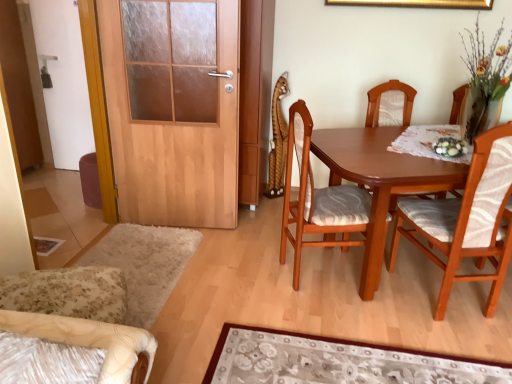
The height and width of the screenshot is (384, 512). What do you see at coordinates (390, 104) in the screenshot? I see `wooden chair with patterned cushion at center, which is counted as the second chair, starting from the right` at bounding box center [390, 104].

Image resolution: width=512 pixels, height=384 pixels. In order to click on wooden door at left in this screenshot , I will do `click(173, 108)`.

This screenshot has width=512, height=384. What do you see at coordinates (466, 219) in the screenshot?
I see `wooden chair with patterned cushion at right, which appears as the 4th chair when viewed from the left` at bounding box center [466, 219].

This screenshot has height=384, width=512. In order to click on floral carpet at lower center in this screenshot , I will do `click(336, 361)`.

Describe the element at coordinates (336, 361) in the screenshot. I see `floral carpet at lower center` at that location.

Describe the element at coordinates (317, 199) in the screenshot. I see `wooden chair with patterned cushion at center, the second chair from the left` at that location.

Find the location of a particular element. The width and height of the screenshot is (512, 384). wooden chair with patterned cushion at center, positioned as the third chair in right-to-left order is located at coordinates (317, 199).

Image resolution: width=512 pixels, height=384 pixels. I want to click on gold metallic picture frame at upper center, so click(418, 3).

Locate an element on the screen. The width and height of the screenshot is (512, 384). wooden chair with patterned cushion at center, which is the 3th chair from left to right is located at coordinates (390, 104).

Between point (50, 49) and point (435, 3), which one is positioned in front?

The point (435, 3) is closer to the camera.

Can you confirm if white glossy door at left is shorter than gold metallic picture frame at upper center?

No, white glossy door at left is not shorter than gold metallic picture frame at upper center.

Is gold metallic picture frame at upper center inside white glossy door at left?

No, gold metallic picture frame at upper center is not surrounded by white glossy door at left.

The height and width of the screenshot is (384, 512). I want to click on screen door beneath the gold metallic picture frame at upper center (from a real-world perspective), so click(x=64, y=80).

Where is `picture frame above the wooden door at left (from a real-world perspective)`? Image resolution: width=512 pixels, height=384 pixels. picture frame above the wooden door at left (from a real-world perspective) is located at coordinates (418, 3).

In terms of width, does wooden door at left look wider or thinner when compared to gold metallic picture frame at upper center?

wooden door at left is wider than gold metallic picture frame at upper center.

In the scene shown: Is wooden door at left turned away from gold metallic picture frame at upper center?

That's not correct — wooden door at left is not looking away from gold metallic picture frame at upper center.

You are a GUI agent. You are given a task and a screenshot of the screen. Output one action in this format:
    pyautogui.click(x=<x>, y=<y>)
    Task: Click on the screen door to the left of floral fabric armchair at lower left, which appears as the 4th chair when viewed from the right
    
    Given the screenshot: What is the action you would take?
    pyautogui.click(x=64, y=80)

From their relative heights in the image, would you say white glossy door at left is taller or shorter than floral fabric armchair at lower left, which appears as the 4th chair when viewed from the right?

Clearly, white glossy door at left is taller compared to floral fabric armchair at lower left, which appears as the 4th chair when viewed from the right.

From the image's perspective, which is above, white glossy door at left or floral fabric armchair at lower left, the first chair from the left?

white glossy door at left.

Is point (407, 371) positioned before point (217, 143)?

Yes, it is in front of point (217, 143).

The image size is (512, 384). What are the coordinates of `door behind the floral carpet at lower center` in the screenshot? It's located at (173, 108).

From the image's perspective, relative to wooden door at left, is floral carpet at lower center above or below?

Based on their image positions, floral carpet at lower center is located beneath wooden door at left.

Can you confirm if floral carpet at lower center is smaller than wooden door at left?

Yes, floral carpet at lower center is smaller than wooden door at left.

Is point (184, 57) closer or farther from the camera than point (38, 327)?

Point (184, 57) is farther from the camera than point (38, 327).

Can you see wooden door at left touching floral fabric armchair at lower left, the first chair from the left?

No, wooden door at left is not with floral fabric armchair at lower left, the first chair from the left.

Can we say wooden door at left lies outside floral fabric armchair at lower left, the first chair from the left?

Yes, wooden door at left is outside of floral fabric armchair at lower left, the first chair from the left.

You are a GUI agent. You are given a task and a screenshot of the screen. Output one action in this format:
    pyautogui.click(x=<x>, y=<y>)
    Task: Click on the picture frame behind the floral carpet at lower center
    The width and height of the screenshot is (512, 384).
    Given the screenshot: What is the action you would take?
    pyautogui.click(x=418, y=3)

Considering the positions of point (468, 4) and point (433, 363), is point (468, 4) closer or farther from the camera than point (433, 363)?

Point (468, 4) is positioned farther from the camera compared to point (433, 363).

Is gold metallic picture frame at upper center further to the viewer compared to floral carpet at lower center?

That is True.

Is floral carpet at lower center inside or outside of wooden chair with patterned cushion at center, positioned as the third chair in right-to-left order?

floral carpet at lower center is not enclosed by wooden chair with patterned cushion at center, positioned as the third chair in right-to-left order.

Which of these two, floral carpet at lower center or wooden chair with patterned cushion at center, the second chair from the left, is smaller?

Smaller between the two is floral carpet at lower center.

Considering the positions of objects floral carpet at lower center and wooden chair with patterned cushion at center, the second chair from the left, in the image provided, who is more to the left, floral carpet at lower center or wooden chair with patterned cushion at center, the second chair from the left,?

Positioned to the left is wooden chair with patterned cushion at center, the second chair from the left.

This screenshot has width=512, height=384. What are the coordinates of `screen door on the left side of gold metallic picture frame at upper center` in the screenshot? It's located at coord(64,80).

The height and width of the screenshot is (384, 512). I want to click on door in front of the gold metallic picture frame at upper center, so click(x=173, y=108).

Looking at the image, which one is located further to wooden chair with patterned cushion at center, the second chair from the left, gold metallic picture frame at upper center or wooden chair with patterned cushion at center, which is counted as the second chair, starting from the right?

gold metallic picture frame at upper center is further to wooden chair with patterned cushion at center, the second chair from the left.

Based on their spatial positions, is gold metallic picture frame at upper center or wooden chair with patterned cushion at center, the second chair from the left, closer to white glossy door at left?

wooden chair with patterned cushion at center, the second chair from the left.

From the image, which object appears to be farther from gold metallic picture frame at upper center, floral carpet at lower center or wooden chair with patterned cushion at center, positioned as the third chair in right-to-left order?

The object further to gold metallic picture frame at upper center is floral carpet at lower center.

Which object lies nearer to the anchor point wooden chair with patterned cushion at center, positioned as the third chair in right-to-left order, wooden door at left or floral fabric armchair at lower left, which appears as the 4th chair when viewed from the right?

Based on the image, wooden door at left appears to be nearer to wooden chair with patterned cushion at center, positioned as the third chair in right-to-left order.

Considering their positions, is wooden chair with patterned cushion at right, which appears as the 4th chair when viewed from the left, positioned further to wooden chair with patterned cushion at center, which is the 3th chair from left to right, than wooden chair with patterned cushion at center, positioned as the third chair in right-to-left order?

The object further to wooden chair with patterned cushion at center, which is the 3th chair from left to right, is wooden chair with patterned cushion at right, which appears as the 4th chair when viewed from the left.

Considering their positions, is gold metallic picture frame at upper center positioned closer to wooden chair with patterned cushion at center, which is counted as the second chair, starting from the right, than white glossy door at left?

Based on the image, gold metallic picture frame at upper center appears to be nearer to wooden chair with patterned cushion at center, which is counted as the second chair, starting from the right.

Estimate the real-world distances between objects in this image. Which object is further from white glossy door at left, floral fabric armchair at lower left, which appears as the 4th chair when viewed from the right, or wooden door at left?

floral fabric armchair at lower left, which appears as the 4th chair when viewed from the right, is further to white glossy door at left.

From the image, which object appears to be farther from wooden chair with patterned cushion at right, which appears as the 4th chair when viewed from the left, gold metallic picture frame at upper center or white glossy door at left?

The object further to wooden chair with patterned cushion at right, which appears as the 4th chair when viewed from the left, is white glossy door at left.

This screenshot has height=384, width=512. Identify the location of mat between white glossy door at left and wooden chair with patterned cushion at right, arranged as the first chair when viewed from the right, in the horizontal direction. coord(336,361).

Find the location of a particular element. door situated between white glossy door at left and gold metallic picture frame at upper center from left to right is located at coordinates (173, 108).

Identify the location of mat located between wooden door at left and wooden chair with patterned cushion at center, which is counted as the second chair, starting from the right, in the left-right direction. (336, 361).

This screenshot has height=384, width=512. I want to click on door located between white glossy door at left and wooden chair with patterned cushion at center, which is the 3th chair from left to right, in the left-right direction, so click(x=173, y=108).